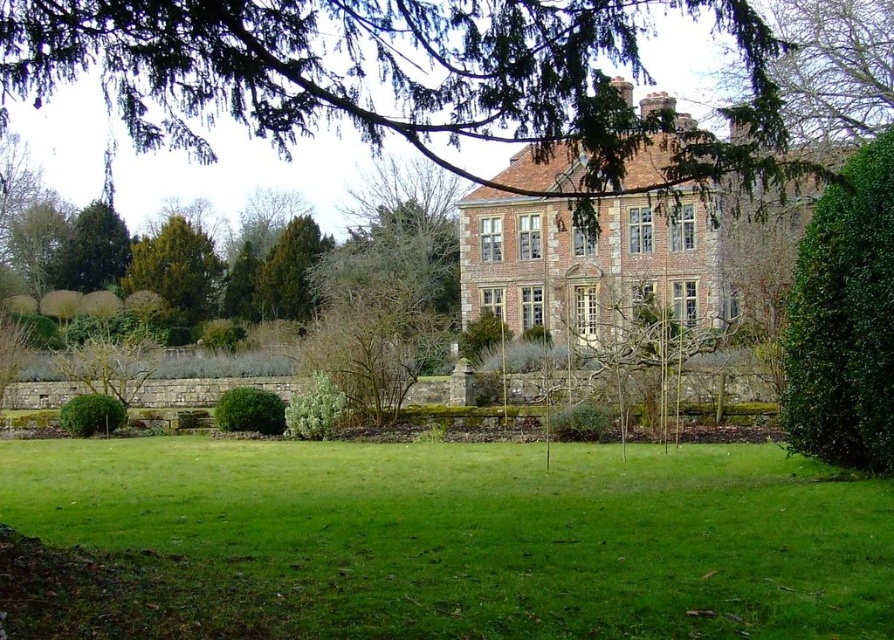
You are standing on the lawn and want to walk from the green leafy tree at left to the green leafy hedge at center. Which direction should you head?

You should head to the right since the green leafy tree at left is to the left of the green leafy hedge at center.

You are standing in the garden looking at the historic brick building. Which object is nearer to you, the green grass at center or the green leafy bush at lower left?

The green grass at center is closer to the viewer than the green leafy bush at lower left.

You are standing at the edge of the green grass at center and want to look up towards the green leafy tree at upper center. In which direction should you turn your head?

You should look upwards because the green grass at center is below the green leafy tree at upper center.